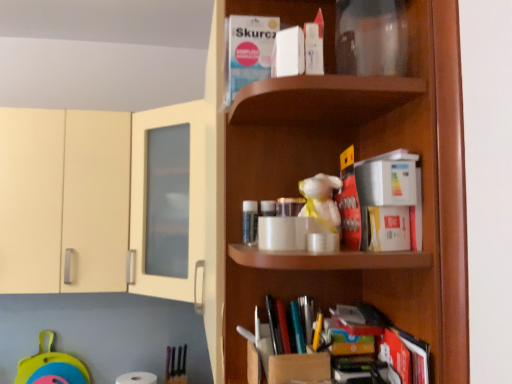
The width and height of the screenshot is (512, 384). What do you see at coordinates (413, 355) in the screenshot? I see `hardcover book at lower right, positioned as the 5th book in left-to-right order` at bounding box center [413, 355].

Describe the element at coordinates (349, 202) in the screenshot. This screenshot has width=512, height=384. I see `red matte book at center, placed as the 3th book when sorted from bottom to top` at that location.

The height and width of the screenshot is (384, 512). What are the coordinates of `multicolored plastic books at lower center, the third book when ordered from left to right` in the screenshot? It's located at pyautogui.click(x=289, y=325).

The image size is (512, 384). I want to click on cardboard box at lower center, so click(288, 367).

The image size is (512, 384). Find the location of `hardcover book at lower right, acting as the first book starting from the right`. hardcover book at lower right, acting as the first book starting from the right is located at coordinates (413, 355).

Is red matte book at center, acting as the 3th book starting from the top, turned away from white matte toilet paper at lower left?

No, red matte book at center, acting as the 3th book starting from the top, is not facing away from white matte toilet paper at lower left.

How many degrees apart are the facing directions of red matte book at center, placed as the fourth book when sorted from left to right, and white matte toilet paper at lower left?

101 degrees.

You are a GUI agent. You are given a task and a screenshot of the screen. Output one action in this format:
    pyautogui.click(x=<x>, y=<y>)
    Task: Click on the 3rd book above the white matte toilet paper at lower left (from a real-world perspective)
    The width and height of the screenshot is (512, 384).
    Given the screenshot: What is the action you would take?
    pyautogui.click(x=349, y=202)

Is there a large distance between multicolored plastic books at lower center, the third book when ordered from left to right, and white matte toilet paper at lower left?

Yes, multicolored plastic books at lower center, the third book when ordered from left to right, and white matte toilet paper at lower left are quite far apart.

Is multicolored plastic books at lower center, marked as the 3th book in a right-to-left arrangement, thinner than white matte toilet paper at lower left?

Yes, multicolored plastic books at lower center, marked as the 3th book in a right-to-left arrangement, is thinner than white matte toilet paper at lower left.

From the image's perspective, is multicolored plastic books at lower center, the 4th book when ordered from top to bottom, beneath white matte toilet paper at lower left?

No, from the image's perspective, multicolored plastic books at lower center, the 4th book when ordered from top to bottom, is not below white matte toilet paper at lower left.

Which of these two, hardcover book at lower right, which is counted as the 1th book, starting from the bottom, or multicolored plastic books at lower center, marked as the 3th book in a right-to-left arrangement, is smaller?

hardcover book at lower right, which is counted as the 1th book, starting from the bottom, is smaller.

Looking at this image, considering the relative sizes of hardcover book at lower right, positioned as the 5th book in left-to-right order, and multicolored plastic books at lower center, the third book when ordered from left to right, in the image provided, is hardcover book at lower right, positioned as the 5th book in left-to-right order, wider than multicolored plastic books at lower center, the third book when ordered from left to right,?

In fact, hardcover book at lower right, positioned as the 5th book in left-to-right order, might be narrower than multicolored plastic books at lower center, the third book when ordered from left to right.

How far apart are hardcover book at lower right, which is counted as the 1th book, starting from the bottom, and multicolored plastic books at lower center, marked as the 3th book in a right-to-left arrangement?

6.87 inches.

In terms of height, does hardcover book at lower right, acting as the first book starting from the right, look taller or shorter compared to multicolored plastic books at lower center, marked as the 3th book in a right-to-left arrangement?

Clearly, hardcover book at lower right, acting as the first book starting from the right, is shorter compared to multicolored plastic books at lower center, marked as the 3th book in a right-to-left arrangement.

Is red matte book at center, placed as the fourth book when sorted from left to right, not near multicolored plastic books at lower center, which ranks as the 2th book in bottom-to-top order?

No, red matte book at center, placed as the fourth book when sorted from left to right, is not far away from multicolored plastic books at lower center, which ranks as the 2th book in bottom-to-top order.

Which is farther, [345,161] or [302,322]?

The point [302,322] is farther.

Is red matte book at center, placed as the 3th book when sorted from bottom to top, to the left of multicolored plastic books at lower center, the 4th book when ordered from top to bottom, from the viewer's perspective?

In fact, red matte book at center, placed as the 3th book when sorted from bottom to top, is to the right of multicolored plastic books at lower center, the 4th book when ordered from top to bottom.

How distant is red matte book at center, positioned as the second book in right-to-left order, from white matte book at upper center, acting as the second book starting from the left?

8.52 inches.

Is red matte book at center, placed as the fourth book when sorted from left to right, spatially inside white matte book at upper center, which is the 4th book from bottom to top, or outside of it?

red matte book at center, placed as the fourth book when sorted from left to right, is not enclosed by white matte book at upper center, which is the 4th book from bottom to top.

Is red matte book at center, positioned as the second book in right-to-left order, aimed at white matte book at upper center, which is the 4th book from bottom to top?

No, red matte book at center, positioned as the second book in right-to-left order, does not turn towards white matte book at upper center, which is the 4th book from bottom to top.

From the image's perspective, is red matte book at center, positioned as the second book in right-to-left order, above or below white matte book at upper center, the 2th book in the top-to-bottom sequence?

From the image's perspective, red matte book at center, positioned as the second book in right-to-left order, appears below white matte book at upper center, the 2th book in the top-to-bottom sequence.

Considering the sizes of white matte book at upper center, which is the fourth book in right-to-left order, and red matte book at center, placed as the fourth book when sorted from left to right, in the image, is white matte book at upper center, which is the fourth book in right-to-left order, wider or thinner than red matte book at center, placed as the fourth book when sorted from left to right,?

white matte book at upper center, which is the fourth book in right-to-left order, is wider than red matte book at center, placed as the fourth book when sorted from left to right.

Is the depth of white matte book at upper center, which is the 4th book from bottom to top, greater than that of red matte book at center, positioned as the second book in right-to-left order?

No, it is not.

Can you confirm if white matte book at upper center, acting as the second book starting from the left, is bigger than red matte book at center, placed as the fourth book when sorted from left to right?

No, white matte book at upper center, acting as the second book starting from the left, is not bigger than red matte book at center, placed as the fourth book when sorted from left to right.

Can you confirm if white matte book at upper center, the 2th book in the top-to-bottom sequence, is positioned to the right of red matte book at center, positioned as the second book in right-to-left order?

Incorrect, white matte book at upper center, the 2th book in the top-to-bottom sequence, is not on the right side of red matte book at center, positioned as the second book in right-to-left order.

Is hardcover book at lower right, which is the fifth book in top-to-bottom order, aimed at white matte toilet paper at lower left?

No, hardcover book at lower right, which is the fifth book in top-to-bottom order, is not turned towards white matte toilet paper at lower left.

Which object is positioned more to the right, hardcover book at lower right, which is the fifth book in top-to-bottom order, or white matte toilet paper at lower left?

From the viewer's perspective, hardcover book at lower right, which is the fifth book in top-to-bottom order, appears more on the right side.

What's the angular difference between hardcover book at lower right, which is the fifth book in top-to-bottom order, and white matte toilet paper at lower left's facing directions?

The angular difference between hardcover book at lower right, which is the fifth book in top-to-bottom order, and white matte toilet paper at lower left is 94.8 degrees.

From a real-world perspective, is hardcover book at lower right, positioned as the 5th book in left-to-right order, over white matte toilet paper at lower left?

Yes, from a real-world perspective, hardcover book at lower right, positioned as the 5th book in left-to-right order, is above white matte toilet paper at lower left.

You are a GUI agent. You are given a task and a screenshot of the screen. Output one action in this format:
    pyautogui.click(x=<x>, y=<y>)
    Task: Click on the 3rd book directly above the white matte toilet paper at lower left (from a real-world perspective)
    Image resolution: width=512 pixels, height=384 pixels.
    Given the screenshot: What is the action you would take?
    pyautogui.click(x=349, y=202)

The width and height of the screenshot is (512, 384). I want to click on the 1st book in front when counting from the white matte toilet paper at lower left, so click(289, 325).

Considering their positions, is red matte book at center, placed as the 3th book when sorted from bottom to top, positioned closer to cardboard box at lower center than multicolored plastic books at lower center, marked as the 3th book in a right-to-left arrangement?

Among the two, multicolored plastic books at lower center, marked as the 3th book in a right-to-left arrangement, is located nearer to cardboard box at lower center.

Estimate the real-world distances between objects in this image. Which object is further from white matte toilet paper at lower left, white matte book at upper center, the 2th book in the top-to-bottom sequence, or hardcover book at lower right, which is counted as the 1th book, starting from the bottom?

white matte book at upper center, the 2th book in the top-to-bottom sequence, lies further to white matte toilet paper at lower left than the other object.

Consider the image. When comparing their distances from red matte book at center, placed as the 3th book when sorted from bottom to top, does white matte toilet paper at lower left or hardcover book at lower right, which is counted as the 1th book, starting from the bottom, seem closer?

hardcover book at lower right, which is counted as the 1th book, starting from the bottom, is positioned closer to the anchor red matte book at center, placed as the 3th book when sorted from bottom to top.

Estimate the real-world distances between objects in this image. Which object is closer to white matte toilet paper at lower left, red matte book at center, placed as the 3th book when sorted from bottom to top, or hardcover book at lower right, which is counted as the 1th book, starting from the bottom?

The object closer to white matte toilet paper at lower left is hardcover book at lower right, which is counted as the 1th book, starting from the bottom.

Considering their positions, is white matte book at upper center, which is counted as the 1th book, starting from the top, positioned further to multicolored plastic books at lower center, the third book when ordered from left to right, than red matte book at center, acting as the 3th book starting from the top?

Based on the image, white matte book at upper center, which is counted as the 1th book, starting from the top, appears to be further to multicolored plastic books at lower center, the third book when ordered from left to right.

Based on their spatial positions, is cardboard box at lower center or hardcover book at lower right, which is the fifth book in top-to-bottom order, further from white matte book at upper center, which is the 4th book from bottom to top?

Among the two, cardboard box at lower center is located further to white matte book at upper center, which is the 4th book from bottom to top.

Considering their positions, is white matte book at upper center, which is counted as the 1th book, starting from the top, positioned further to white matte toilet paper at lower left than hardcover book at lower right, acting as the first book starting from the right?

white matte book at upper center, which is counted as the 1th book, starting from the top, is positioned further to the anchor white matte toilet paper at lower left.

Looking at the image, which one is located closer to red matte book at center, placed as the fourth book when sorted from left to right, white matte toilet paper at lower left or white matte book at upper center, which is the fourth book in right-to-left order?

Based on the image, white matte book at upper center, which is the fourth book in right-to-left order, appears to be nearer to red matte book at center, placed as the fourth book when sorted from left to right.

What are the coordinates of `cardboard box between hardcover book at lower right, positioned as the 5th book in left-to-right order, and white matte toilet paper at lower left, along the z-axis` in the screenshot? It's located at (288, 367).

Where is `book that lies between red matte book at center, placed as the 3th book when sorted from bottom to top, and hardcover book at lower right, which is the fifth book in top-to-bottom order, from top to bottom`? book that lies between red matte book at center, placed as the 3th book when sorted from bottom to top, and hardcover book at lower right, which is the fifth book in top-to-bottom order, from top to bottom is located at coordinates (289, 325).

At what (x,y) coordinates should I click in order to perform the action: click on book between white matte book at upper center, positioned as the fifth book in bottom-to-top order, and red matte book at center, placed as the fourth book when sorted from left to right, vertically. Please return your answer as a coordinate pair (x, y). This screenshot has width=512, height=384. Looking at the image, I should click on (288, 53).

Identify the location of book between white matte book at upper center, arranged as the 5th book when viewed from the right, and white matte toilet paper at lower left, along the z-axis. The image size is (512, 384). (289, 325).